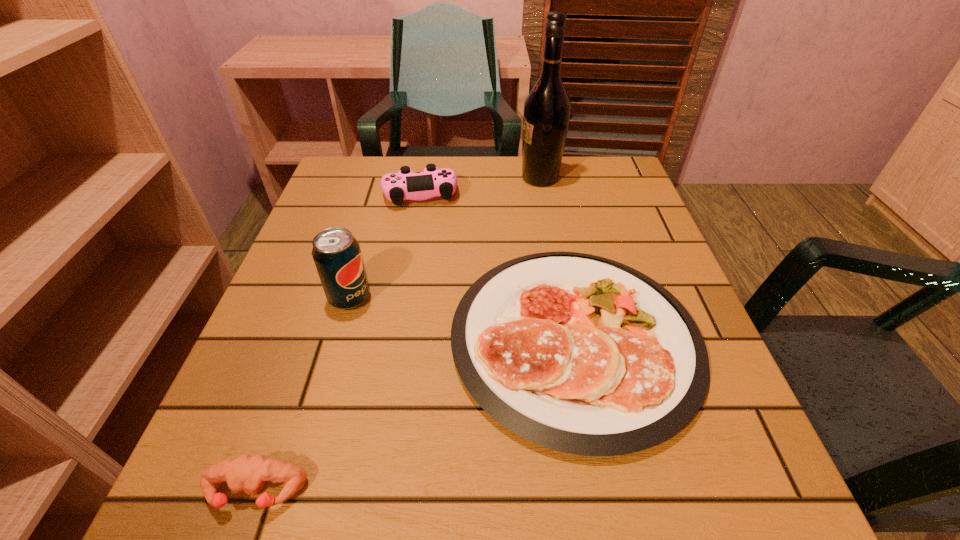
You are a GUI agent. You are given a task and a screenshot of the screen. Output one action in this format:
    pyautogui.click(x=<x>, y=<y>)
    Task: Click on the object that is positioned at the near left corner
    
    Given the screenshot: What is the action you would take?
    pyautogui.click(x=247, y=473)

In order to click on object located at the near right corner in this screenshot , I will do `click(578, 353)`.

At what (x,y) coordinates should I click in order to perform the action: click on vacant position at the far edge of the desktop. Please return your answer as a coordinate pair (x, y). Looking at the image, I should click on (470, 173).

The image size is (960, 540). I want to click on blank space at the near edge of the desktop, so click(x=492, y=470).

Identify the location of vacant area at the left edge of the desktop. (373, 250).

Locate an element on the screen. This screenshot has width=960, height=540. vacant region at the right edge of the desktop is located at coordinates (597, 240).

This screenshot has width=960, height=540. In the image, there is a desktop. Find the location of `free region at the far left corner`. free region at the far left corner is located at coordinates (334, 203).

Where is `vacant region at the far right corner of the desktop`? The width and height of the screenshot is (960, 540). vacant region at the far right corner of the desktop is located at coordinates (636, 206).

Where is `vacant area that lies between the nearest object and the dish`? The image size is (960, 540). vacant area that lies between the nearest object and the dish is located at coordinates (415, 416).

Where is `free spot between the third shortest object and the nearest object`? The image size is (960, 540). free spot between the third shortest object and the nearest object is located at coordinates (338, 343).